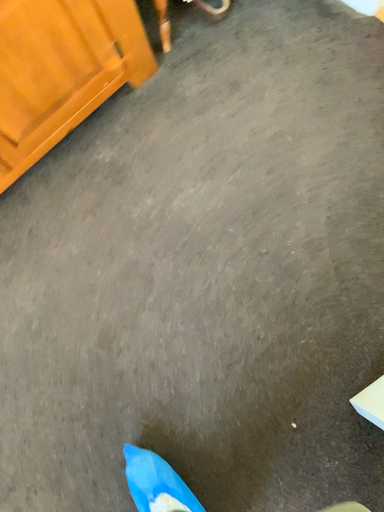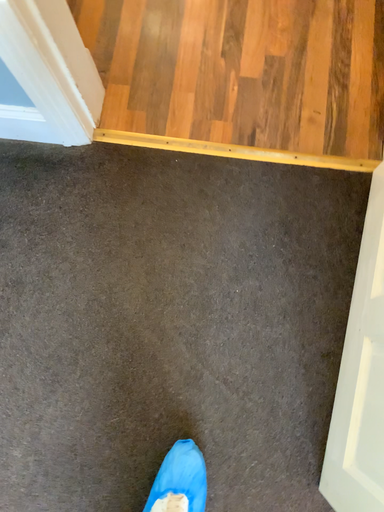
Question: Which way did the camera rotate in the video?

Choices:
 (A) rotated upward
 (B) rotated downward

Answer: (A)